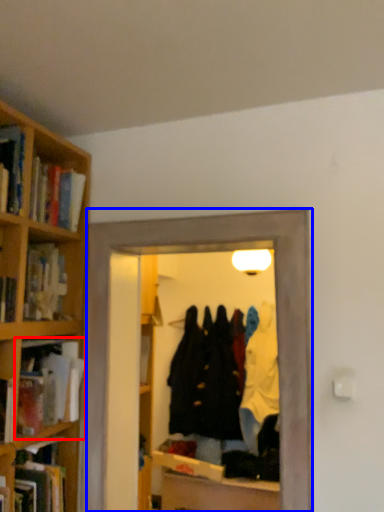
Question: Which object appears closest to the camera in this image, book (highlighted by a red box) or glass door (highlighted by a blue box)?

Choices:
 (A) book
 (B) glass door

Answer: (B)